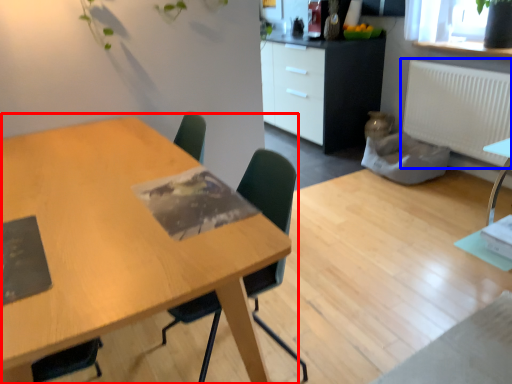
Question: Which point is further to the camera, table (highlighted by a red box) or radiator (highlighted by a blue box)?

Choices:
 (A) table
 (B) radiator

Answer: (B)